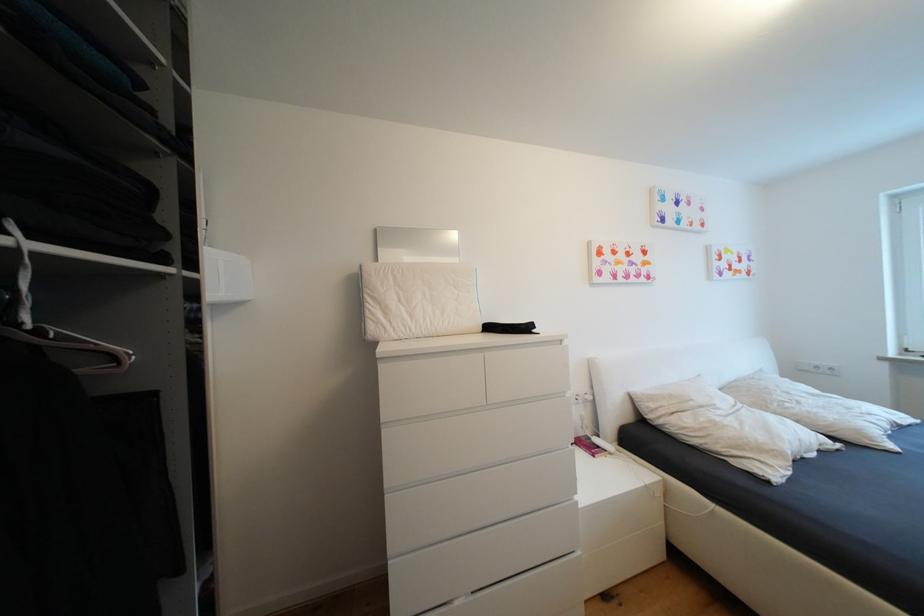
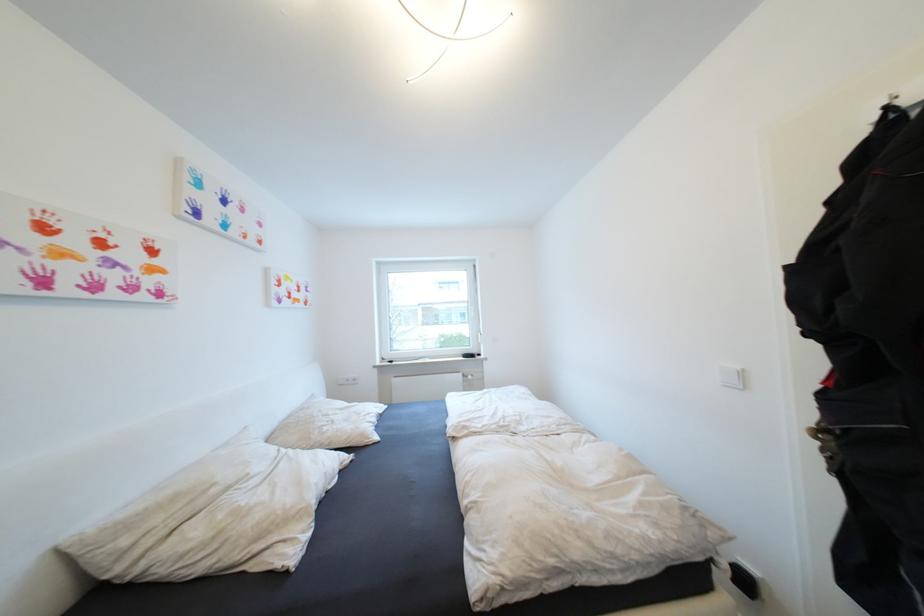
Locate, in the second image, the point that corresponds to point 823,369 in the first image.

(355, 381)